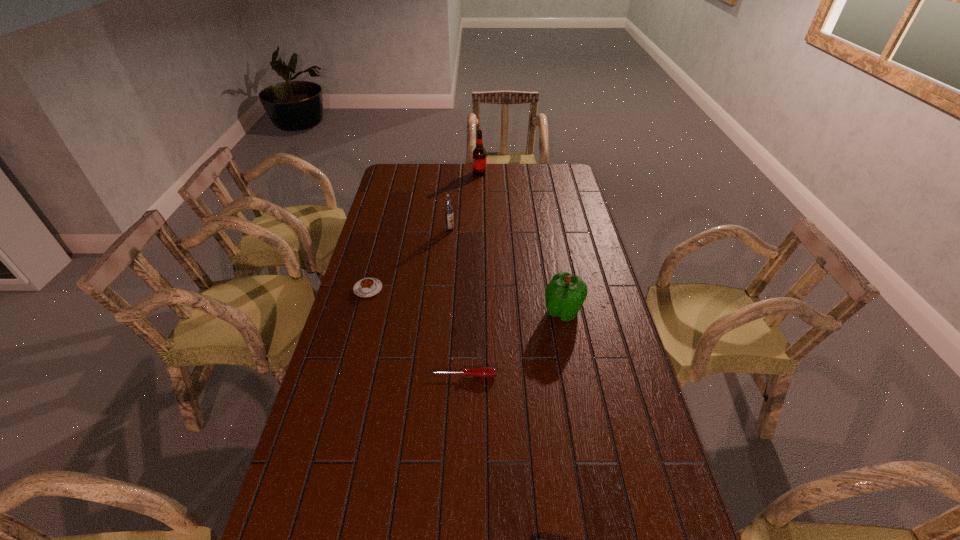
In the image, there is a desktop. Identify the location of vacant space at the far right corner. (567, 174).

You are a GUI agent. You are given a task and a screenshot of the screen. Output one action in this format:
    pyautogui.click(x=<x>, y=<y>)
    Task: Click on the free space between the farther screwdriver and the root beer
    
    Given the screenshot: What is the action you would take?
    pyautogui.click(x=471, y=274)

This screenshot has height=540, width=960. I want to click on free space between the second farthest object and the bell pepper, so click(x=506, y=271).

What are the coordinates of `vacant space that is in between the third shortest object and the farthest object` in the screenshot? It's located at (424, 231).

Identify the location of the fifth closest object to the root beer. (536, 539).

Point out which object is positioned as the fifth nearest to the leftmost object. Please provide its 2D coordinates. Your answer should be formatted as a tuple, i.e. [(x, y)], where the tuple contains the x and y coordinates of a point satisfying the conditions above.

[(536, 539)]

Image resolution: width=960 pixels, height=540 pixels. What are the coordinates of `the second closest screwdriver to the tallest object` in the screenshot? It's located at (536, 539).

Identify which screwdriver is the second nearest to the vodka. Please provide its 2D coordinates. Your answer should be formatted as a tuple, i.e. [(x, y)], where the tuple contains the x and y coordinates of a point satisfying the conditions above.

[(536, 539)]

At what (x,y) coordinates should I click in order to perform the action: click on blank space that satisfies the following two spatial constraints: 1. on the label of the fifth farthest object; 2. on the right side of the second farthest object. Please return your answer as a coordinate pair (x, y). Looking at the image, I should click on (437, 375).